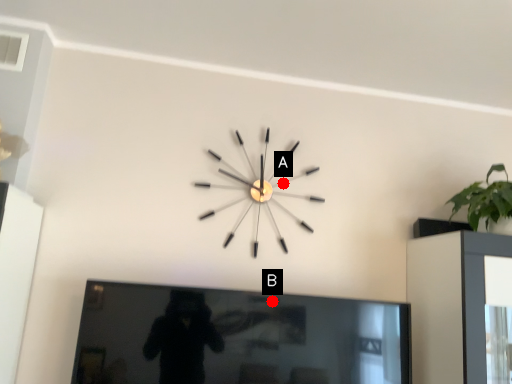
Question: Two points are circled on the image, labeled by A and B beside each circle. Which point is closer to the camera taking this photo?

Choices:
 (A) A is closer
 (B) B is closer

Answer: (B)